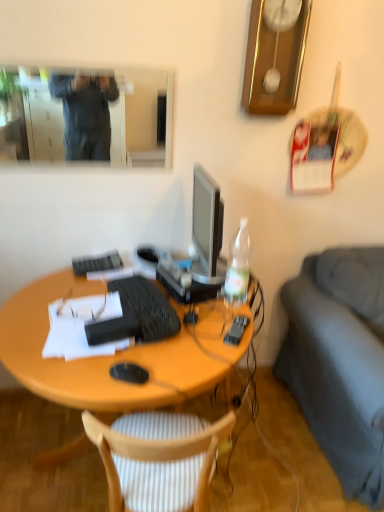
The width and height of the screenshot is (384, 512). Find the location of `free point to the left of black matte computer mouse at center`. free point to the left of black matte computer mouse at center is located at coordinates (81, 369).